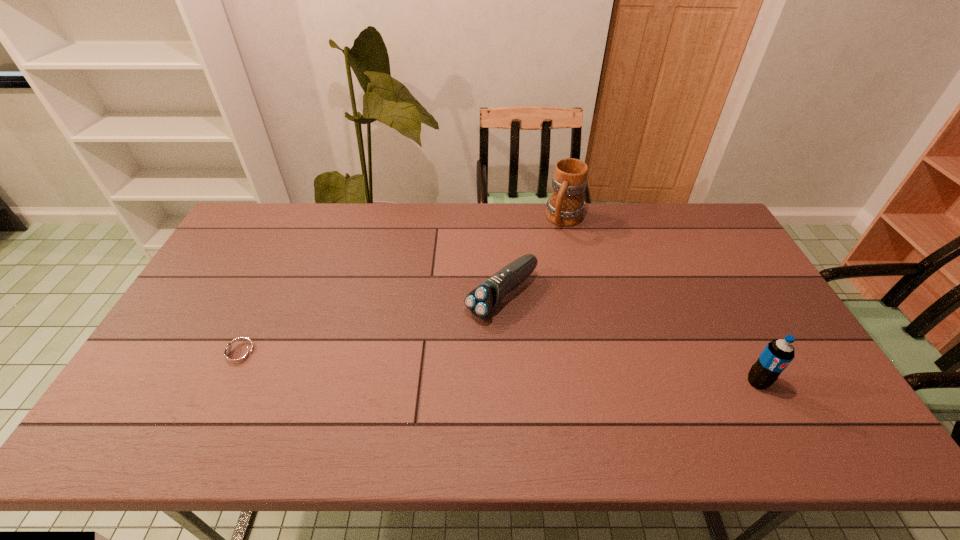
You are a GUI agent. You are given a task and a screenshot of the screen. Output one action in this format:
    pyautogui.click(x=<x>, y=<y>)
    Task: Click on the shortest object
    This screenshot has height=540, width=960.
    Given the screenshot: What is the action you would take?
    pyautogui.click(x=239, y=354)

Find the location of `the leftmost object`. the leftmost object is located at coordinates (239, 354).

Where is `soda bottle`? soda bottle is located at coordinates (777, 355).

At what (x,y) coordinates should I click in order to perform the action: click on the rightmost object. Please return your answer as a coordinate pair (x, y). Image resolution: width=960 pixels, height=540 pixels. Looking at the image, I should click on (777, 355).

Locate an element on the screen. the second object from right to left is located at coordinates (565, 207).

Locate an element on the screen. This screenshot has height=540, width=960. mug is located at coordinates (565, 207).

I want to click on electric shaver, so click(482, 301).

You are a GUI agent. You are given a task and a screenshot of the screen. Output one action in this format:
    pyautogui.click(x=<x>, y=<y>)
    Task: Click on the third nearest object
    
    Given the screenshot: What is the action you would take?
    pyautogui.click(x=482, y=301)

This screenshot has width=960, height=540. I want to click on free region located 0.070m on the face of the watch, so click(186, 354).

Where is `free point located 0.050m on the back of the rightmost object`? free point located 0.050m on the back of the rightmost object is located at coordinates (744, 356).